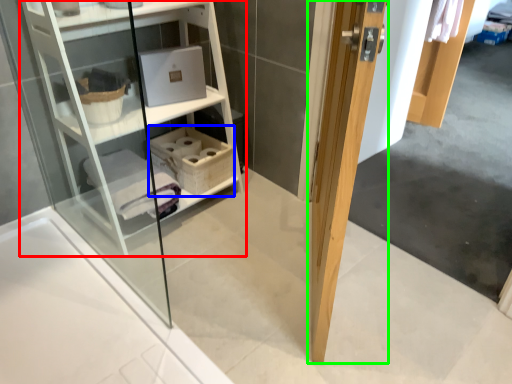
Question: Based on their relative distances, which object is farther from shelf (highlighted by a red box)? Choose from basket (highlighted by a blue box) and door (highlighted by a green box).

Choices:
 (A) basket
 (B) door

Answer: (B)